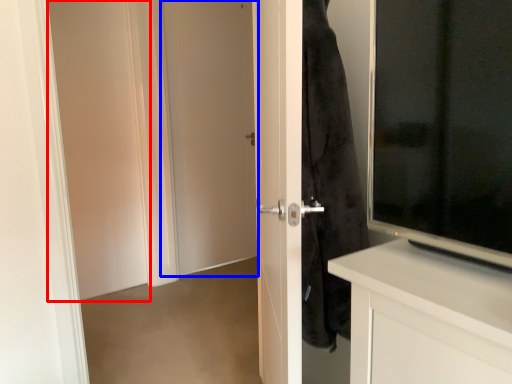
Question: Which point is further to the camera, screen door (highlighted by a red box) or door (highlighted by a blue box)?

Choices:
 (A) screen door
 (B) door

Answer: (B)